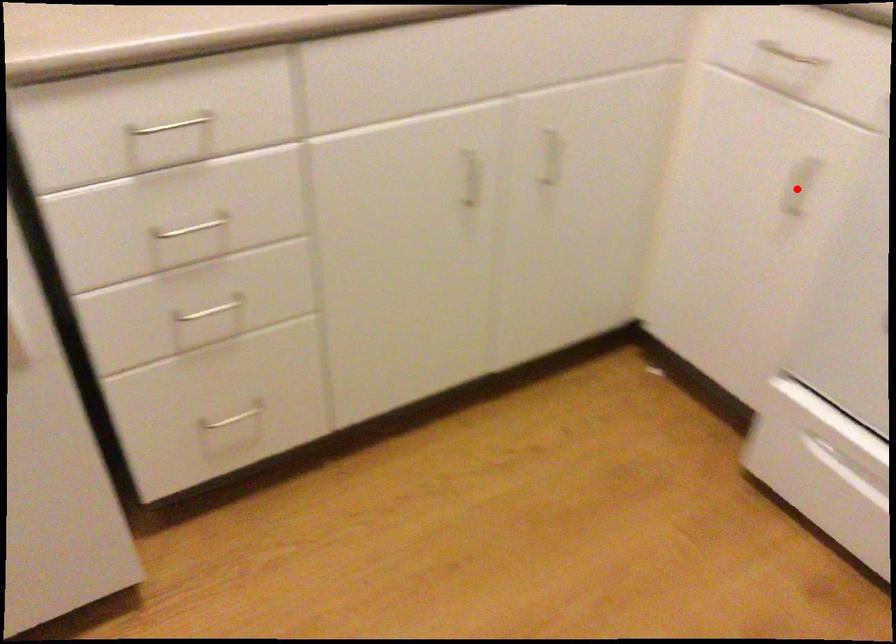
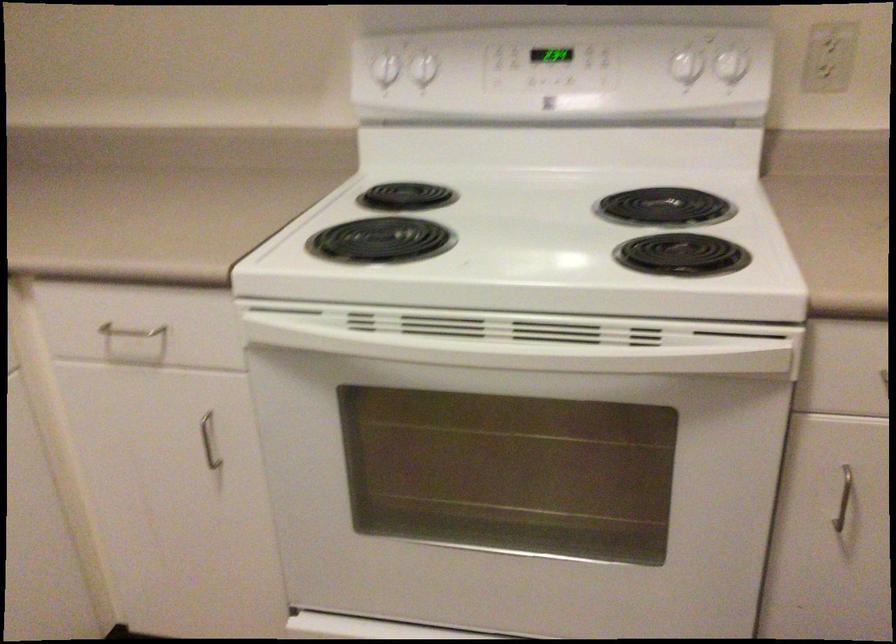
Question: I am providing you with two images of the same scene from different viewpoints. A red point is marked on the first image. Is the red point's position out of view in image 2?

Choices:
 (A) Yes
 (B) No

Answer: (B)